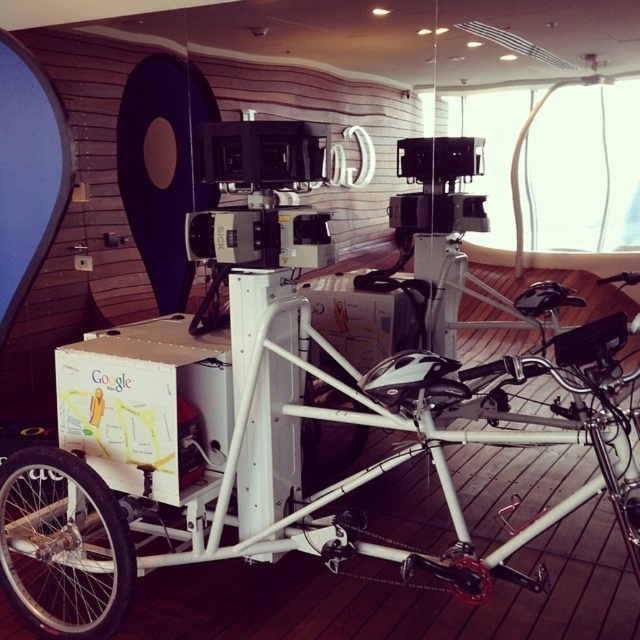
Question: Which point is farther to the camera?

Choices:
 (A) black rubber wheel at lower left
 (B) white cardboard box at center

Answer: (B)

Question: Which point is closer to the camera?

Choices:
 (A) white cardboard box at center
 (B) black matte wheel at center

Answer: (B)

Question: Among these objects, which one is nearest to the camera?

Choices:
 (A) black rubber wheel at lower left
 (B) black matte wheel at center
 (C) white matte bicycle at center

Answer: (C)

Question: Does white cardboard box at center appear under black matte wheel at center?

Choices:
 (A) yes
 (B) no

Answer: (B)

Question: Can you confirm if white cardboard box at center is positioned below black matte wheel at center?

Choices:
 (A) no
 (B) yes

Answer: (A)

Question: Is the position of black rubber wheel at lower left less distant than that of white cardboard box at center?

Choices:
 (A) yes
 (B) no

Answer: (A)